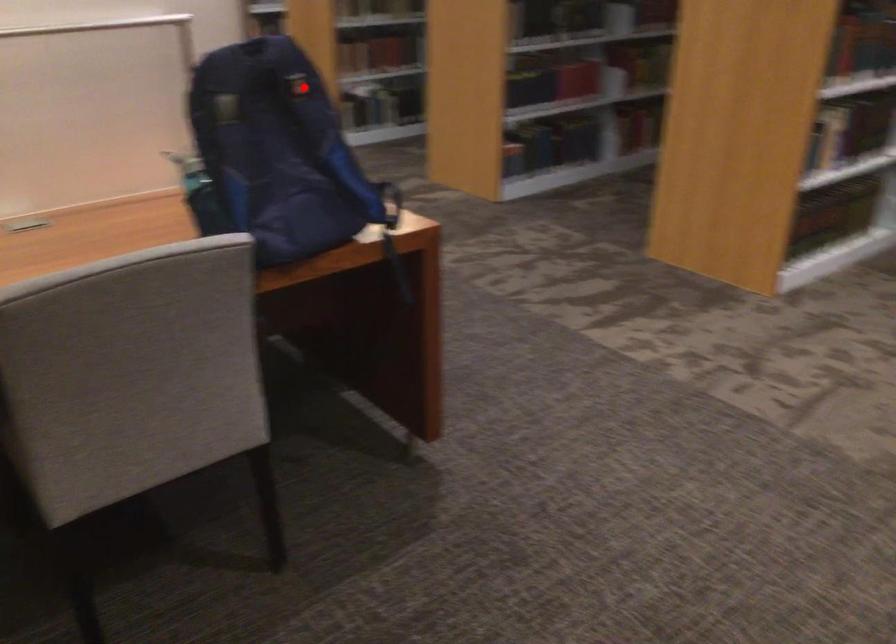
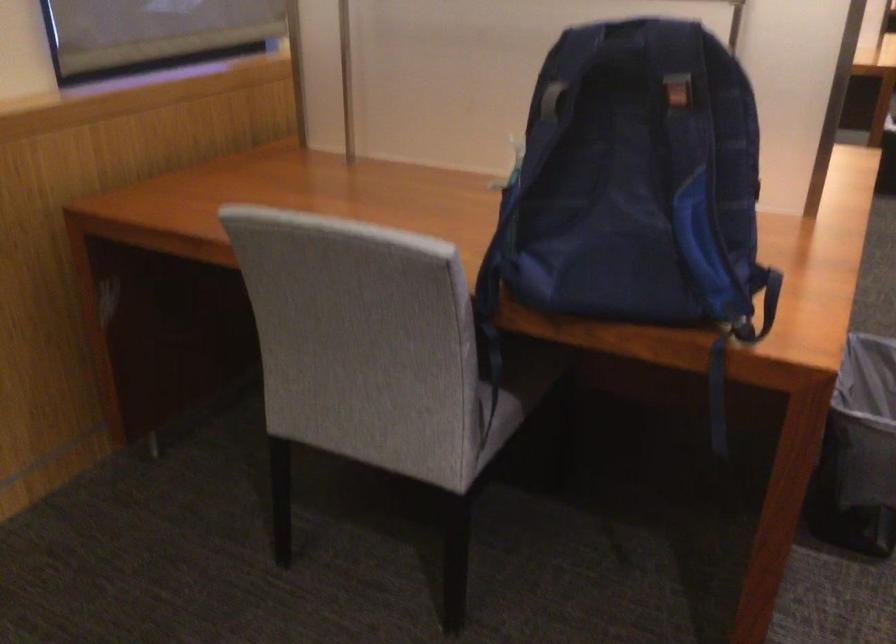
Question: I am providing you with two images of the same scene from different viewpoints. A red point is shown in image1. For the corresponding object point in image2, is it positioned nearer or farther from the camera?

Choices:
 (A) Nearer
 (B) Farther

Answer: (A)